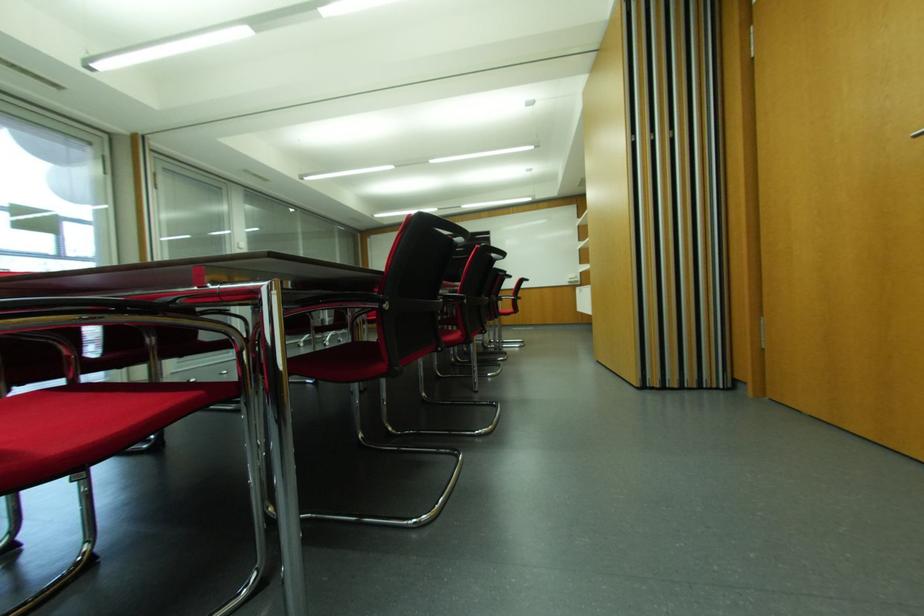
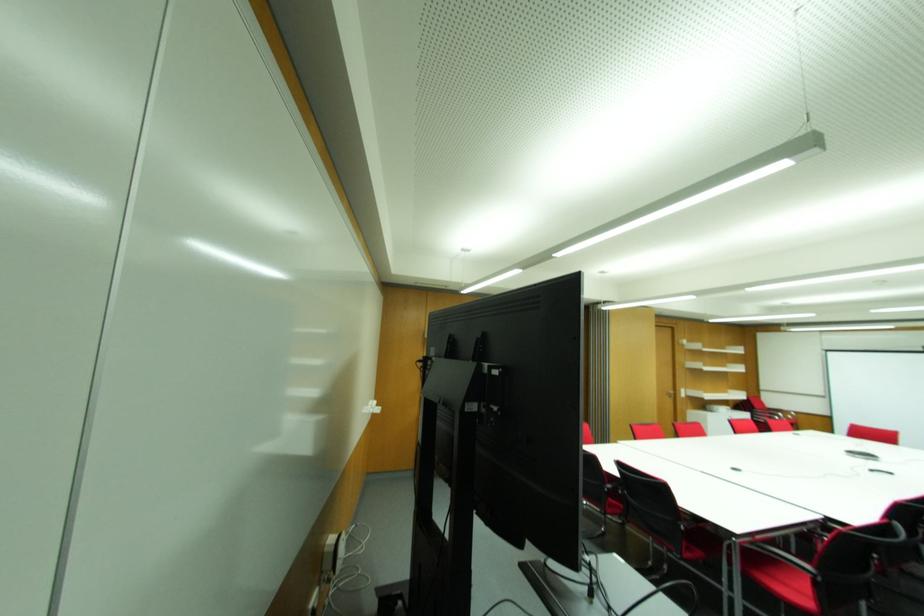
Question: I am providing you with two images of the same scene from different viewpoints. After the viewpoint changes to image2, which objects are now occluded?

Choices:
 (A) metal door handle
 (B) black electric guitar
 (C) red chair sitting surface
 (D) black chair armrest

Answer: (C)